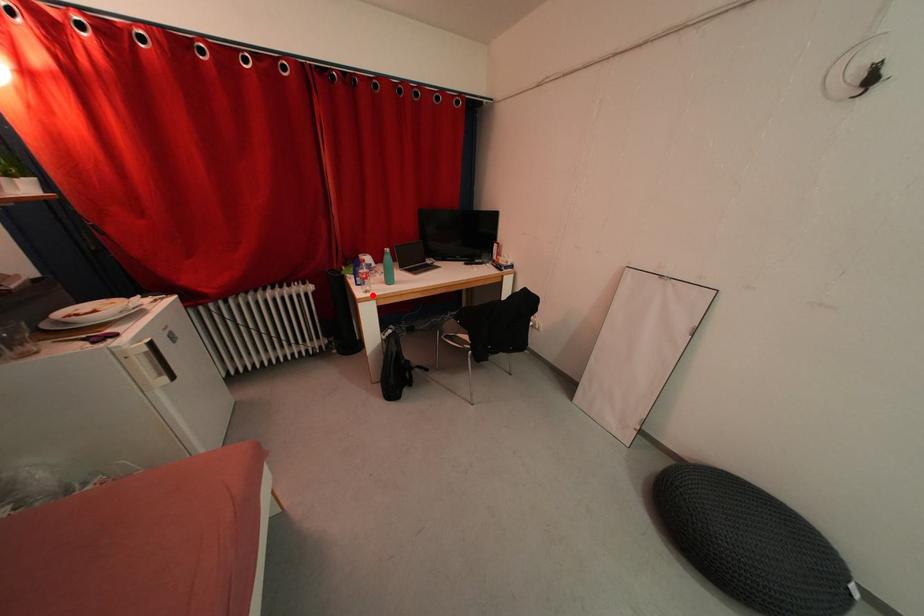
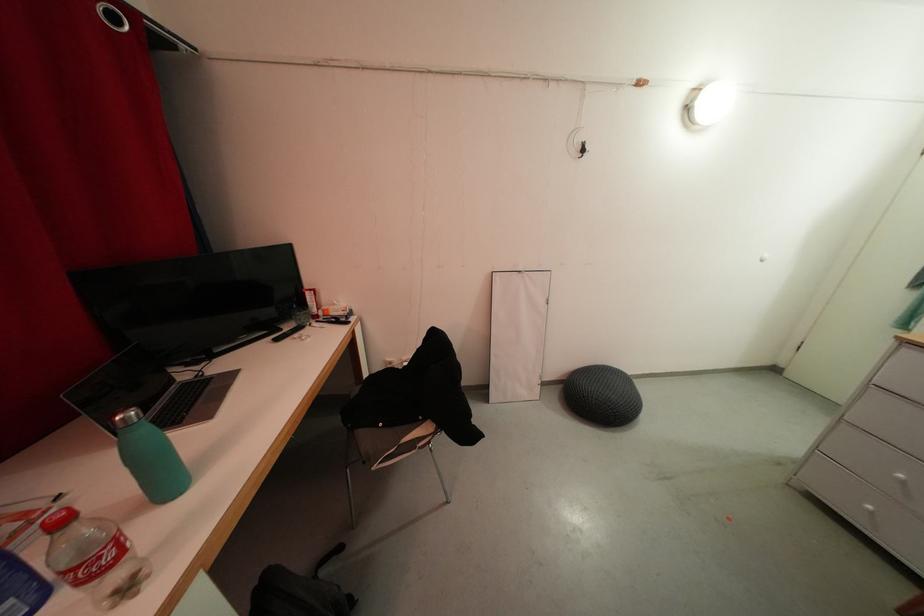
Question: I am providing you with two images of the same scene from different viewpoints. Given a red point in image1, look at the same physical point in image2. Is it:

Choices:
 (A) Closer to the viewpoint
 (B) Farther from the viewpoint

Answer: (A)